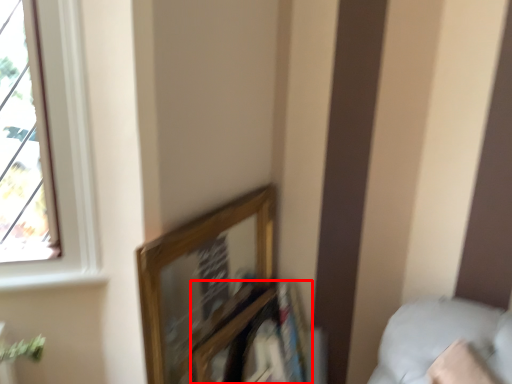
Question: Observing the image, what is the correct spatial positioning of shelf (annotated by the red box) in reference to pillow?

Choices:
 (A) left
 (B) right

Answer: (A)